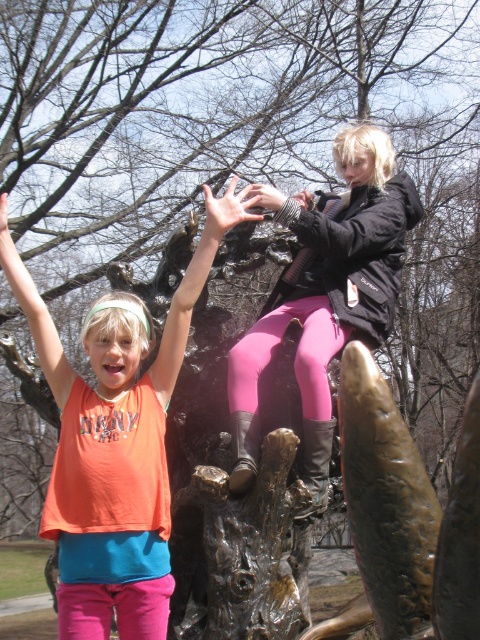
Question: Which of the following is the closest to the observer?

Choices:
 (A) (204, 259)
 (B) (369, 228)

Answer: (A)

Question: Where is pink matte leggings at upper center located in relation to orange fabric shirt at upper left in the image?

Choices:
 (A) right
 (B) left

Answer: (A)

Question: Which point is farther to the camera?

Choices:
 (A) orange fabric shirt at upper left
 (B) pink matte leggings at upper center

Answer: (B)

Question: Does pink matte leggings at upper center have a lesser width compared to orange fabric shirt at upper left?

Choices:
 (A) no
 (B) yes

Answer: (A)

Question: Does pink matte leggings at upper center have a greater width compared to orange fabric shirt at upper left?

Choices:
 (A) no
 (B) yes

Answer: (B)